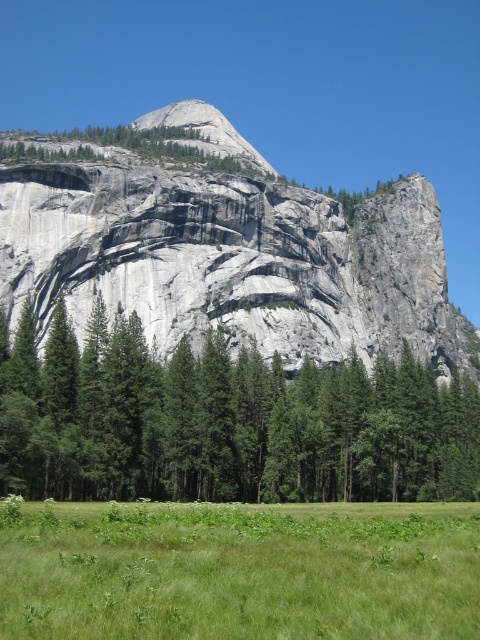
What are the coordinates of `gray/granite mountain at center` in the screenshot? It's located at (223, 244).

Does gray/granite mountain at center have a lesser width compared to green matte tree at center?

No, gray/granite mountain at center is not thinner than green matte tree at center.

Which is behind, point (29, 152) or point (240, 368)?

Point (29, 152)

Locate an element on the screen. Image resolution: width=480 pixels, height=640 pixels. gray/granite mountain at center is located at coordinates (223, 244).

Which of these two, green matte tree at center or green grassy pasture at lower center, stands shorter?

green grassy pasture at lower center

Between point (416, 470) and point (84, 528), which one is positioned in front?

Point (84, 528) is more forward.

Who is more distant from viewer, (66, 483) or (76, 536)?

Point (66, 483)

Image resolution: width=480 pixels, height=640 pixels. What are the coordinates of `green matte tree at center` in the screenshot? It's located at (224, 420).

Can you confirm if gray/granite mountain at center is taller than green grassy pasture at lower center?

Indeed, gray/granite mountain at center has a greater height compared to green grassy pasture at lower center.

Where is `gray/granite mountain at center`? This screenshot has width=480, height=640. gray/granite mountain at center is located at coordinates (223, 244).

This screenshot has width=480, height=640. What are the coordinates of `gray/granite mountain at center` in the screenshot? It's located at (223, 244).